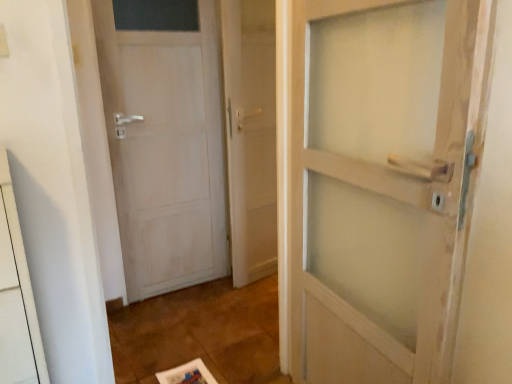
Question: Can you confirm if white matte door at left is bigger than clear glass door at center?

Choices:
 (A) no
 (B) yes

Answer: (B)

Question: Considering the relative sizes of white matte door at left and clear glass door at center in the image provided, is white matte door at left wider than clear glass door at center?

Choices:
 (A) no
 (B) yes

Answer: (A)

Question: Is white matte door at left positioned behind clear glass door at center?

Choices:
 (A) no
 (B) yes

Answer: (A)

Question: Is white matte door at left far away from clear glass door at center?

Choices:
 (A) no
 (B) yes

Answer: (A)

Question: Could you tell me if white matte door at left is turned towards clear glass door at center?

Choices:
 (A) yes
 (B) no

Answer: (B)

Question: Is white matte door at left surrounding clear glass door at center?

Choices:
 (A) yes
 (B) no

Answer: (B)

Question: Can you confirm if clear glass door at center is wider than white matte door at left?

Choices:
 (A) no
 (B) yes

Answer: (B)

Question: Is clear glass door at center facing away from white matte door at left?

Choices:
 (A) yes
 (B) no

Answer: (B)

Question: Considering the relative sizes of clear glass door at center and white matte door at left in the image provided, is clear glass door at center smaller than white matte door at left?

Choices:
 (A) no
 (B) yes

Answer: (B)

Question: From a real-world perspective, is clear glass door at center physically above white matte door at left?

Choices:
 (A) yes
 (B) no

Answer: (A)

Question: Can you confirm if clear glass door at center is positioned to the right of white matte door at left?

Choices:
 (A) no
 (B) yes

Answer: (B)

Question: Considering the relative positions of clear glass door at center and white matte door at left in the image provided, is clear glass door at center behind white matte door at left?

Choices:
 (A) yes
 (B) no

Answer: (A)

Question: Relative to clear glass door at center, is white matte door at left in front or behind?

Choices:
 (A) behind
 (B) front

Answer: (B)